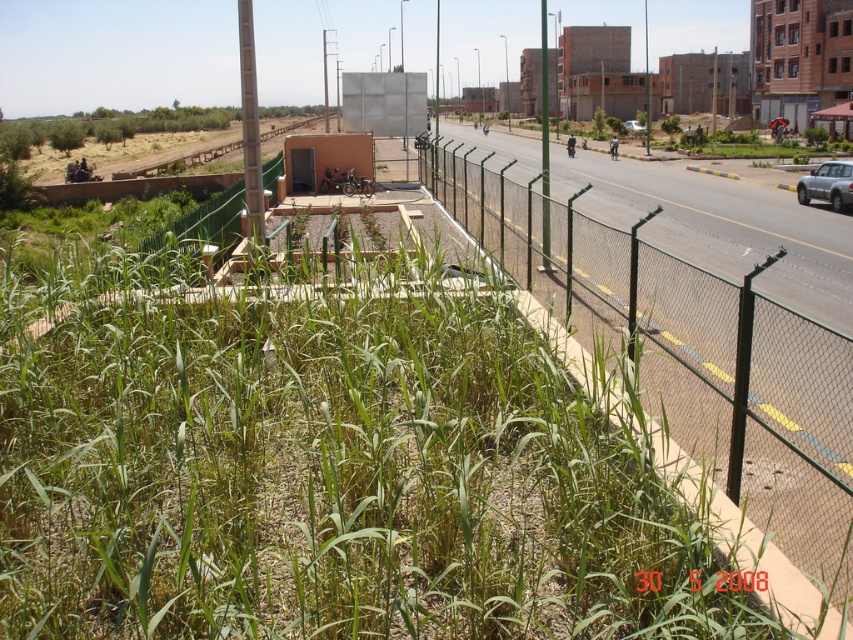
Question: Which object is closer to the camera taking this photo?

Choices:
 (A) green chain-link fence at right
 (B) green wire mesh fence at right

Answer: (A)

Question: Does green grass at lower left appear on the left side of green wire mesh fence at right?

Choices:
 (A) yes
 (B) no

Answer: (A)

Question: Is green wire mesh fence at right to the left of satin silver car at right from the viewer's perspective?

Choices:
 (A) no
 (B) yes

Answer: (B)

Question: Is green grass at lower left behind satin silver car at right?

Choices:
 (A) yes
 (B) no

Answer: (B)

Question: Among these points, which one is nearest to the camera?

Choices:
 (A) (848, 182)
 (B) (480, 186)
 (C) (7, 336)
 (D) (817, 272)

Answer: (C)

Question: Which object is farther from the camera taking this photo?

Choices:
 (A) satin silver car at right
 (B) green grass at lower left
 (C) green wire mesh fence at right

Answer: (A)